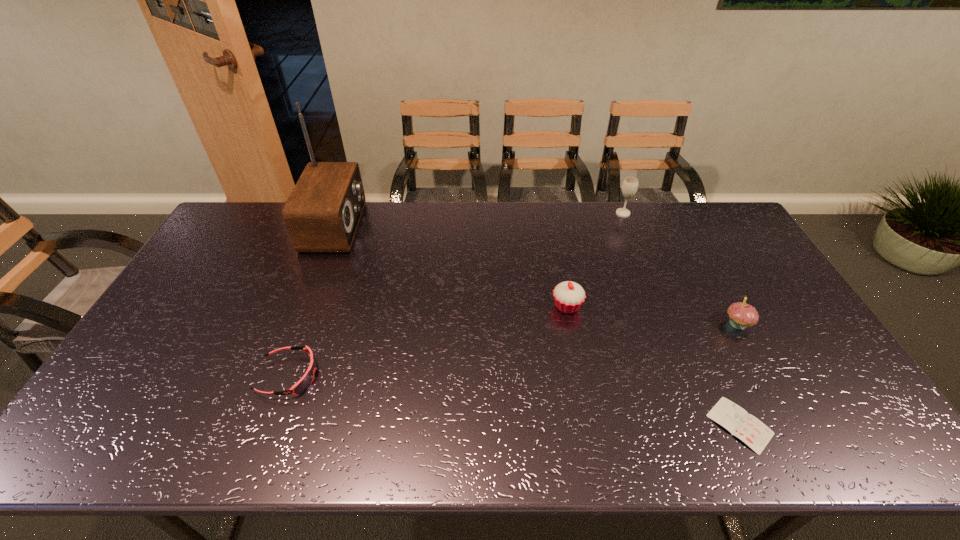
Image resolution: width=960 pixels, height=540 pixels. In order to click on empty location between the right cupcake and the goggles in this screenshot , I will do `click(513, 350)`.

Identify which object is located as the fourth nearest to the second shortest object. Please provide its 2D coordinates. Your answer should be formatted as a tuple, i.e. [(x, y)], where the tuple contains the x and y coordinates of a point satisfying the conditions above.

[(630, 185)]

At what (x,y) coordinates should I click in order to perform the action: click on object that stands as the third closest to the rightmost object. Please return your answer as a coordinate pair (x, y). Looking at the image, I should click on (630, 185).

Locate an element on the screen. The width and height of the screenshot is (960, 540). vacant space that satisfies the following two spatial constraints: 1. on the front-facing side of the tallest object; 2. on the back side of the rightmost object is located at coordinates (299, 323).

I want to click on vacant area in the image that satisfies the following two spatial constraints: 1. on the front side of the wineglass; 2. on the front-facing side of the radio receiver, so click(628, 226).

You are a GUI agent. You are given a task and a screenshot of the screen. Output one action in this format:
    pyautogui.click(x=<x>, y=<y>)
    Task: Click on the free region that satisfies the following two spatial constraints: 1. on the front-facing side of the radio receiver; 2. on the back side of the left cupcake
    This screenshot has width=960, height=540.
    Given the screenshot: What is the action you would take?
    [x=305, y=306]

This screenshot has height=540, width=960. I want to click on free location that satisfies the following two spatial constraints: 1. on the back side of the shortest object; 2. on the front-facing side of the fifth tallest object, so click(x=718, y=376).

Where is `vacant space that satisfies the following two spatial constraints: 1. on the front side of the left cupcake; 2. on the front-facing side of the second shortest object`? vacant space that satisfies the following two spatial constraints: 1. on the front side of the left cupcake; 2. on the front-facing side of the second shortest object is located at coordinates (581, 376).